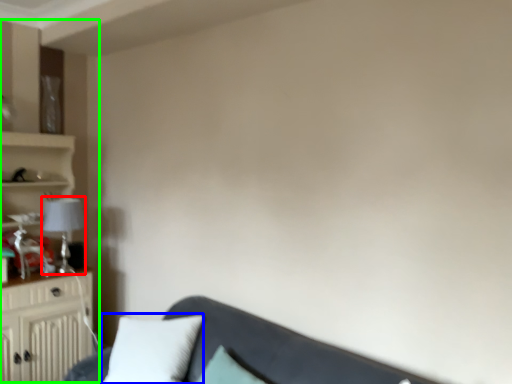
Question: Which object is positioned closest to lamp (highlighted by a red box)? Select from pillow (highlighted by a blue box) and entertainment center (highlighted by a green box).

Choices:
 (A) pillow
 (B) entertainment center

Answer: (B)